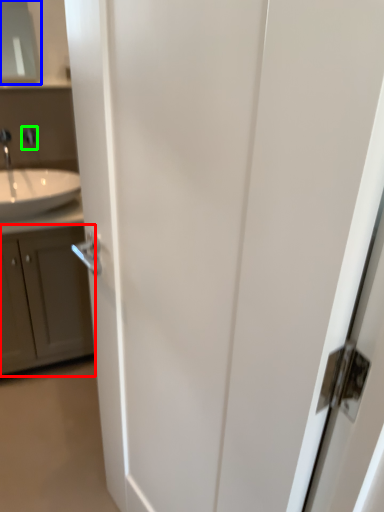
Question: Which is nearer to the cabinetry (highlighted by a red box)? medicine cabinet (highlighted by a blue box) or faucet (highlighted by a green box).

Choices:
 (A) medicine cabinet
 (B) faucet

Answer: (B)